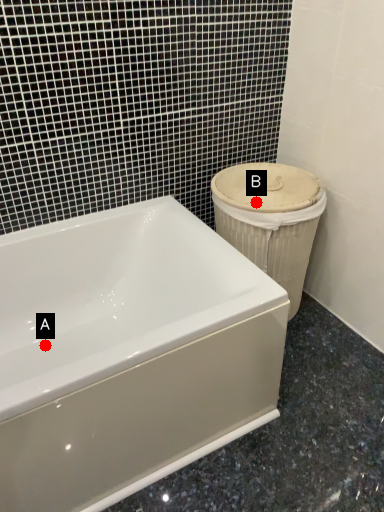
Question: Two points are circled on the image, labeled by A and B beside each circle. Among these points, which one is nearest to the camera?

Choices:
 (A) A is closer
 (B) B is closer

Answer: (B)